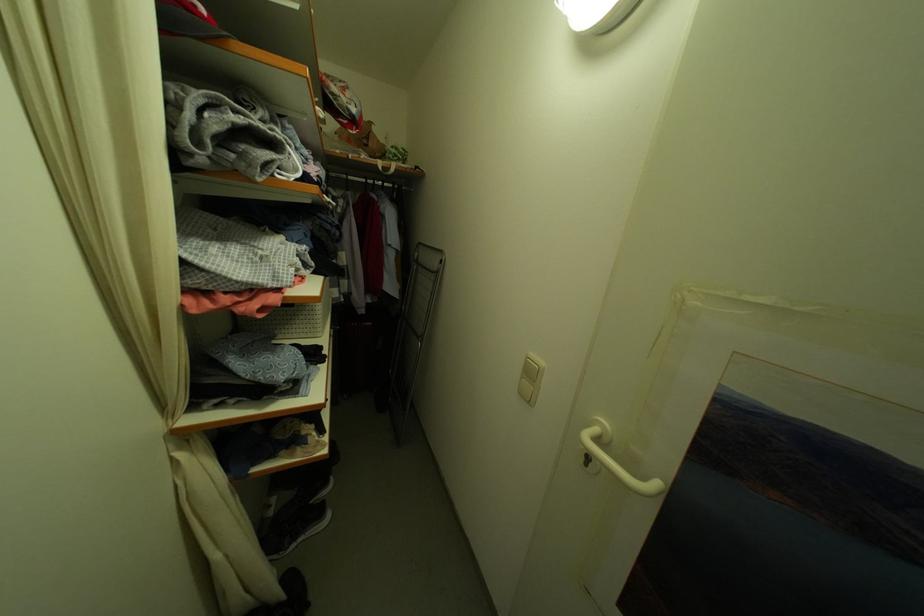
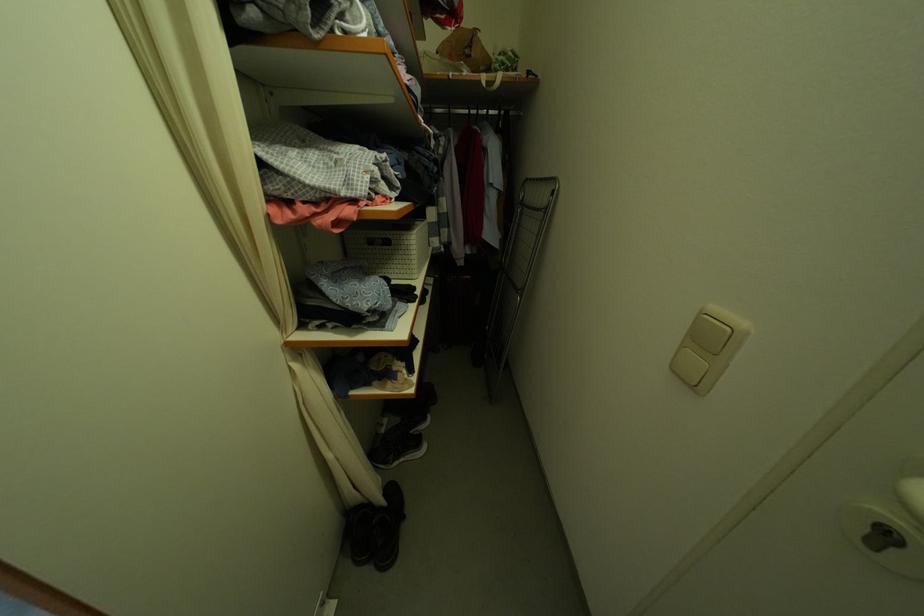
Where in the second image is the point corresponding to pixel 537 376 from the first image?

(713, 342)